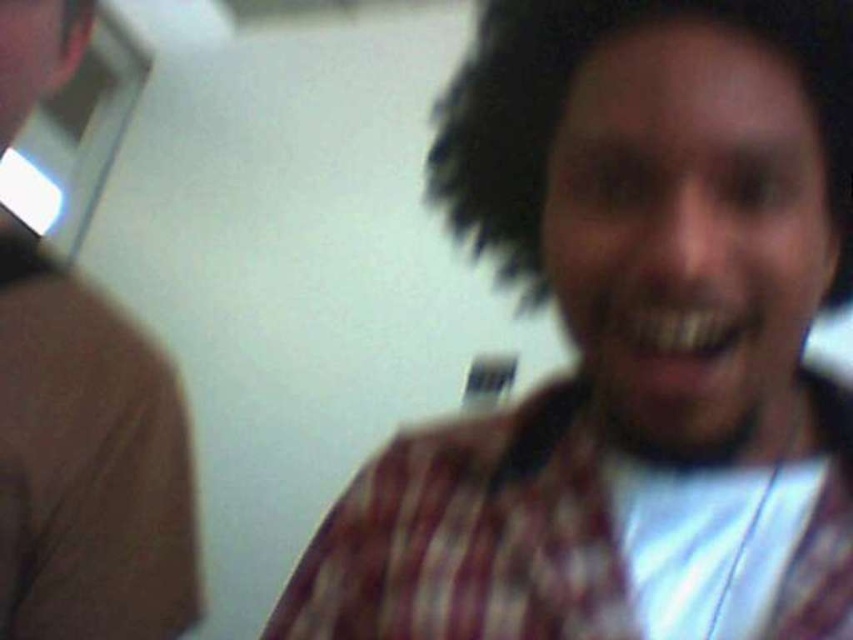
Question: Which object is farther from the camera taking this photo?

Choices:
 (A) plaid shirt at center
 (B) plaid fabric at center
 (C) white cotton shirt at center

Answer: (C)

Question: Which point appears farthest from the camera in this image?

Choices:
 (A) (625, 554)
 (B) (183, 586)
 (C) (811, 10)

Answer: (B)

Question: Can you confirm if plaid shirt at center is thinner than plaid fabric at center?

Choices:
 (A) yes
 (B) no

Answer: (A)

Question: Can you confirm if brown wool sweater at left is thinner than dark curly hair at center?

Choices:
 (A) no
 (B) yes

Answer: (B)

Question: Which object is the farthest from the dark curly hair at center?

Choices:
 (A) plaid fabric at center
 (B) white cotton shirt at center
 (C) brown wool sweater at left
 (D) plaid shirt at center

Answer: (C)

Question: Does plaid shirt at center lie behind plaid fabric at center?

Choices:
 (A) yes
 (B) no

Answer: (B)